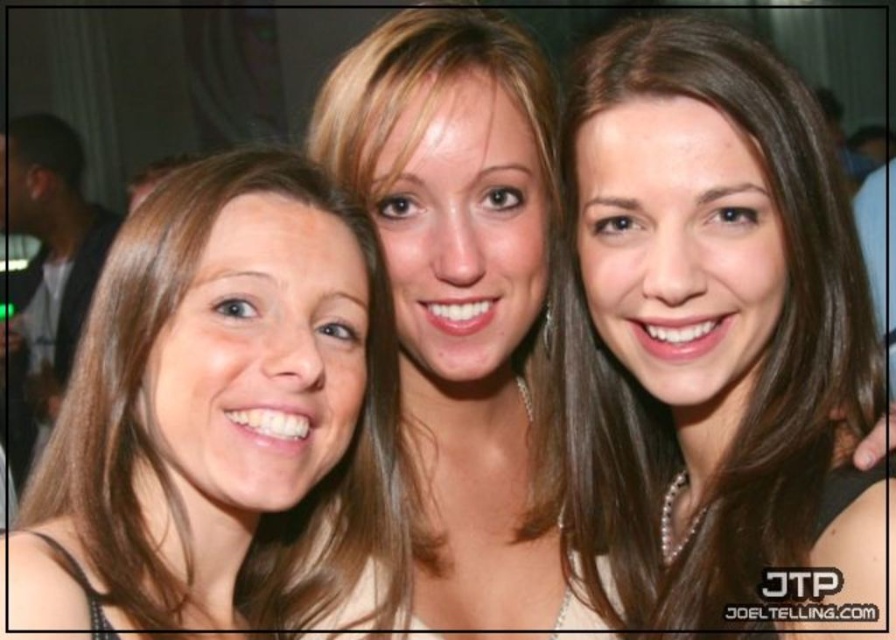
Question: Which object appears farthest from the camera in this image?

Choices:
 (A) brown hair at center
 (B) smooth beige necklace at center
 (C) blonde hair at center
 (D) smooth skin face at center

Answer: (D)

Question: Where is brown hair at center located in relation to smooth beige necklace at center in the image?

Choices:
 (A) below
 (B) above

Answer: (A)

Question: Estimate the real-world distances between objects in this image. Which object is farther from the blonde hair at center?

Choices:
 (A) brown hair at center
 (B) smooth beige necklace at center
 (C) smooth skin face at center

Answer: (C)

Question: Is blonde hair at center smaller than smooth beige necklace at center?

Choices:
 (A) yes
 (B) no

Answer: (B)

Question: Estimate the real-world distances between objects in this image. Which object is closer to the smooth beige necklace at center?

Choices:
 (A) smooth skin face at center
 (B) blonde hair at center
 (C) brown hair at center

Answer: (C)

Question: Can you confirm if smooth beige necklace at center is wider than smooth skin face at center?

Choices:
 (A) yes
 (B) no

Answer: (B)